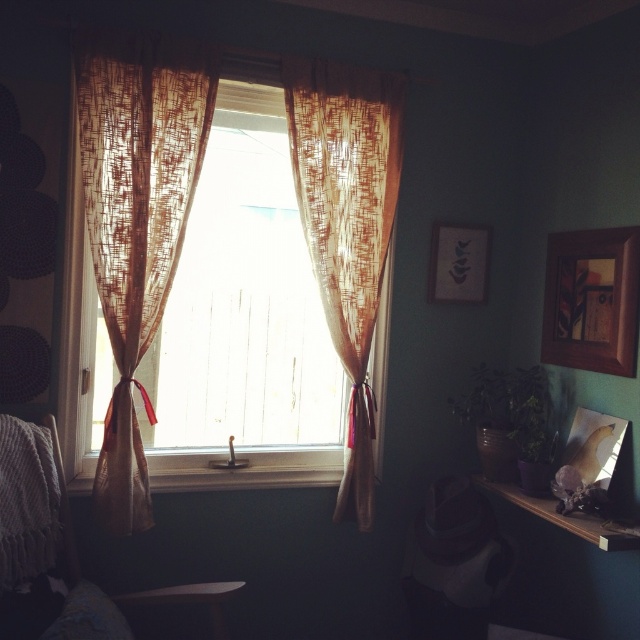
You are arranging a new piece of art in the room and need to know the spatial relationship between the translucent brown curtain at left and the wooden picture frame at upper right. Which object is positioned higher up in the image?

The translucent brown curtain at left is located above the wooden picture frame at upper right, so it is positioned higher up in the image.

You are an interior designer planning to hang a new picture that requires 30 inches of space between the existing matte wooden picture frame at upper right and the wooden shelf at lower right. Based on the current setup, is there enough space for the new picture?

The matte wooden picture frame at upper right and wooden shelf at lower right are 28.17 inches apart. Since the required space is 30 inches, there isn not enough space for the new picture.